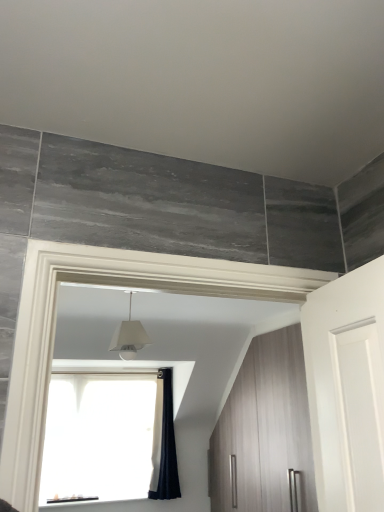
I want to click on white matte lampshade at center, so click(129, 337).

Describe the element at coordinates (129, 337) in the screenshot. I see `white matte lampshade at center` at that location.

Find the location of `white matte lampshade at center`. white matte lampshade at center is located at coordinates (129, 337).